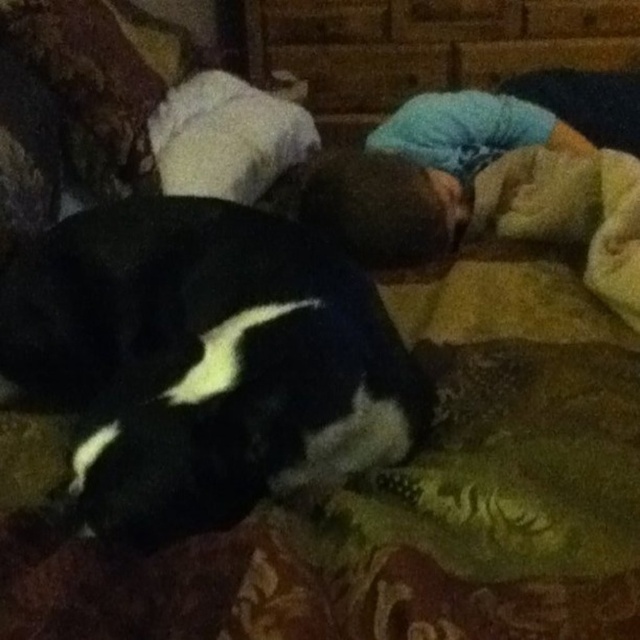
You are standing in the room and see the black and white dog lying on the yellowish green fabric with floral design. There is a point at coordinate (204,360). What is located at that point?

The point at coordinate (204,360) corresponds to black and white fur at center.

You are a photographer trying to capture a close up of the black and white fur at center. The camera you are using has a minimum focusing distance of 60 centimeters. Can you take the photo without moving closer than 60 centimeters?

The black and white fur at center is 70.77 centimeters from the viewer, which is beyond the camera minimum focusing distance of 60 centimeters. Therefore, you can take the photo without moving closer than 60 centimeters.